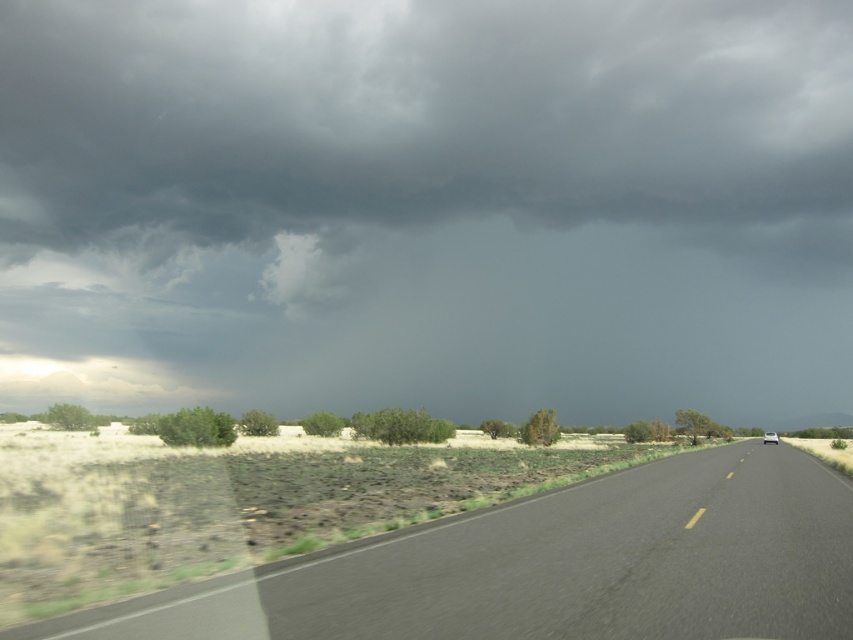
In the scene shown: Which is below, black asphalt road at center or white glossy car at right?

white glossy car at right is lower down.

Who is more distant from viewer, (755, 552) or (764, 438)?

Positioned behind is point (764, 438).

Find the location of a particular element. Image resolution: width=853 pixels, height=640 pixels. black asphalt road at center is located at coordinates (552, 566).